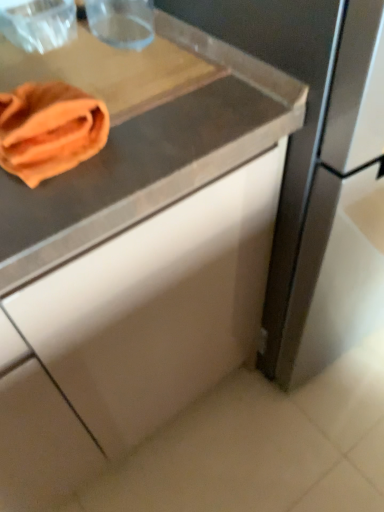
Question: Should I look upward or downward to see orange cloth at upper left?

Choices:
 (A) down
 (B) up

Answer: (B)

Question: Can you confirm if orange microfiber cloth at upper left is positioned to the left of orange cloth at upper left?

Choices:
 (A) yes
 (B) no

Answer: (A)

Question: From a real-world perspective, is orange microfiber cloth at upper left physically below orange cloth at upper left?

Choices:
 (A) no
 (B) yes

Answer: (A)

Question: Is orange microfiber cloth at upper left smaller than orange cloth at upper left?

Choices:
 (A) yes
 (B) no

Answer: (A)

Question: Considering the relative positions of orange microfiber cloth at upper left and orange cloth at upper left in the image provided, is orange microfiber cloth at upper left to the right of orange cloth at upper left from the viewer's perspective?

Choices:
 (A) no
 (B) yes

Answer: (A)

Question: From the image's perspective, would you say orange microfiber cloth at upper left is shown under orange cloth at upper left?

Choices:
 (A) yes
 (B) no

Answer: (A)

Question: Considering the relative sizes of orange microfiber cloth at upper left and orange cloth at upper left in the image provided, is orange microfiber cloth at upper left wider than orange cloth at upper left?

Choices:
 (A) yes
 (B) no

Answer: (B)

Question: Is orange microfiber cloth at upper left surrounded by orange cloth at upper left?

Choices:
 (A) no
 (B) yes

Answer: (A)

Question: From the image's perspective, is orange cloth at upper left beneath orange microfiber cloth at upper left?

Choices:
 (A) yes
 (B) no

Answer: (B)

Question: From the image's perspective, is orange cloth at upper left on orange microfiber cloth at upper left?

Choices:
 (A) no
 (B) yes

Answer: (B)

Question: Is orange cloth at upper left further to camera compared to orange microfiber cloth at upper left?

Choices:
 (A) no
 (B) yes

Answer: (B)

Question: Considering the relative positions of orange cloth at upper left and orange microfiber cloth at upper left in the image provided, is orange cloth at upper left to the left of orange microfiber cloth at upper left from the viewer's perspective?

Choices:
 (A) yes
 (B) no

Answer: (B)

Question: Is orange cloth at upper left positioned with its back to orange microfiber cloth at upper left?

Choices:
 (A) no
 (B) yes

Answer: (A)

Question: Is orange microfiber cloth at upper left in front of or behind orange cloth at upper left in the image?

Choices:
 (A) front
 (B) behind

Answer: (A)